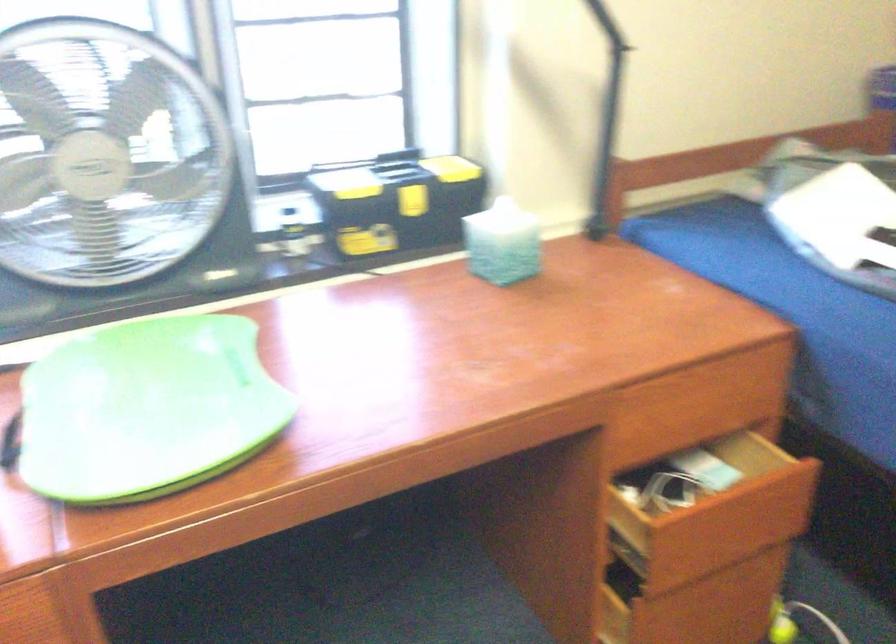
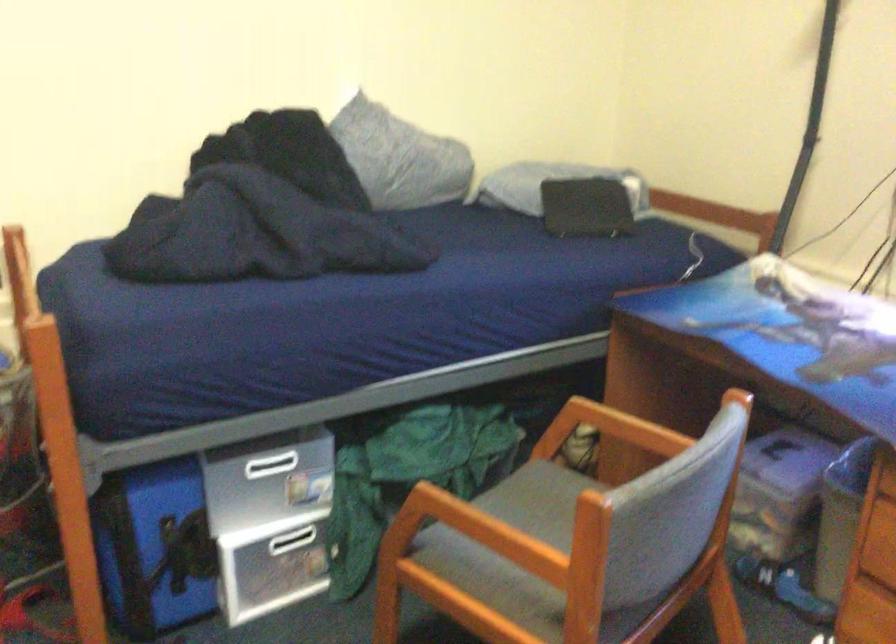
The images are taken continuously from a first-person perspective. In which direction is your viewpoint rotating?

The rotation direction of the camera is left-down.